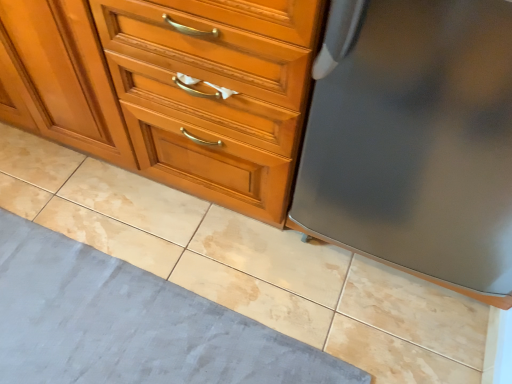
The image size is (512, 384). Identify the location of matte wood chest of drawers at center. (173, 88).

The image size is (512, 384). What do you see at coordinates (130, 324) in the screenshot?
I see `gray fabric bath mat at lower left` at bounding box center [130, 324].

This screenshot has width=512, height=384. I want to click on matte wood chest of drawers at center, so click(x=173, y=88).

Could you tell me if matte wood chest of drawers at center is facing satin gray refrigerator at right?

No, matte wood chest of drawers at center is not turned towards satin gray refrigerator at right.

Is matte wood chest of drawers at center completely or partially outside of satin gray refrigerator at right?

Absolutely, matte wood chest of drawers at center is external to satin gray refrigerator at right.

How different are the orientations of matte wood chest of drawers at center and satin gray refrigerator at right in degrees?

The facing directions of matte wood chest of drawers at center and satin gray refrigerator at right are 0.439 degrees apart.

Between matte wood chest of drawers at center and satin gray refrigerator at right, which one is positioned behind?

Positioned behind is matte wood chest of drawers at center.

Does gray fabric bath mat at lower left turn towards matte wood chest of drawers at center?

No, gray fabric bath mat at lower left is not aimed at matte wood chest of drawers at center.

Considering the relative sizes of gray fabric bath mat at lower left and matte wood chest of drawers at center in the image provided, is gray fabric bath mat at lower left taller than matte wood chest of drawers at center?

No.

In the scene shown: Does gray fabric bath mat at lower left have a larger size compared to matte wood chest of drawers at center?

No.

From a real-world perspective, which is physically below, satin gray refrigerator at right or gray fabric bath mat at lower left?

From a 3D spatial view, gray fabric bath mat at lower left is below.

Considering the positions of objects satin gray refrigerator at right and gray fabric bath mat at lower left in the image provided, who is behind, satin gray refrigerator at right or gray fabric bath mat at lower left?

gray fabric bath mat at lower left is behind.

From the picture: Is satin gray refrigerator at right to the left of gray fabric bath mat at lower left from the viewer's perspective?

Incorrect, satin gray refrigerator at right is not on the left side of gray fabric bath mat at lower left.

Can you confirm if matte wood chest of drawers at center is smaller than gray fabric bath mat at lower left?

No, matte wood chest of drawers at center is not smaller than gray fabric bath mat at lower left.

Which is further, (262, 198) or (120, 264)?

The point (120, 264) is farther.

From a real-world perspective, is matte wood chest of drawers at center above or below gray fabric bath mat at lower left?

From a real-world perspective, matte wood chest of drawers at center is physically above gray fabric bath mat at lower left.

Considering the sizes of objects gray fabric bath mat at lower left and satin gray refrigerator at right in the image provided, who is bigger, gray fabric bath mat at lower left or satin gray refrigerator at right?

satin gray refrigerator at right.

Between gray fabric bath mat at lower left and satin gray refrigerator at right, which one has larger width?

gray fabric bath mat at lower left.

Is the surface of gray fabric bath mat at lower left in direct contact with satin gray refrigerator at right?

No, gray fabric bath mat at lower left is not in contact with satin gray refrigerator at right.

Is point (89, 364) behind point (445, 232)?

That is True.

In the image, is satin gray refrigerator at right positioned in front of or behind matte wood chest of drawers at center?

In the image, satin gray refrigerator at right appears in front of matte wood chest of drawers at center.

Identify the location of the chest of drawers that is above the satin gray refrigerator at right (from a real-world perspective). This screenshot has width=512, height=384. (173, 88).

Does satin gray refrigerator at right touch matte wood chest of drawers at center?

No, satin gray refrigerator at right is not beside matte wood chest of drawers at center.

Considering the relative sizes of satin gray refrigerator at right and matte wood chest of drawers at center in the image provided, is satin gray refrigerator at right taller than matte wood chest of drawers at center?

No.

Where is `the chest of drawers that is behind the satin gray refrigerator at right`? the chest of drawers that is behind the satin gray refrigerator at right is located at coordinates (173, 88).

I want to click on chest of drawers above the gray fabric bath mat at lower left (from a real-world perspective), so click(173, 88).

Looking at the image, which one is located further to satin gray refrigerator at right, matte wood chest of drawers at center or gray fabric bath mat at lower left?

Based on the image, gray fabric bath mat at lower left appears to be further to satin gray refrigerator at right.

Looking at the image, which one is located further to matte wood chest of drawers at center, satin gray refrigerator at right or gray fabric bath mat at lower left?

Based on the image, gray fabric bath mat at lower left appears to be further to matte wood chest of drawers at center.

Estimate the real-world distances between objects in this image. Which object is closer to satin gray refrigerator at right, gray fabric bath mat at lower left or matte wood chest of drawers at center?

Among the two, matte wood chest of drawers at center is located nearer to satin gray refrigerator at right.

From the image, which object appears to be farther from matte wood chest of drawers at center, gray fabric bath mat at lower left or satin gray refrigerator at right?

Among the two, gray fabric bath mat at lower left is located further to matte wood chest of drawers at center.

Which object lies further to the anchor point gray fabric bath mat at lower left, matte wood chest of drawers at center or satin gray refrigerator at right?

satin gray refrigerator at right is positioned further to the anchor gray fabric bath mat at lower left.

Which object lies nearer to the anchor point gray fabric bath mat at lower left, satin gray refrigerator at right or matte wood chest of drawers at center?

Among the two, matte wood chest of drawers at center is located nearer to gray fabric bath mat at lower left.

Where is `refrigerator between matte wood chest of drawers at center and gray fabric bath mat at lower left from top to bottom`? This screenshot has height=384, width=512. refrigerator between matte wood chest of drawers at center and gray fabric bath mat at lower left from top to bottom is located at coordinates (414, 140).